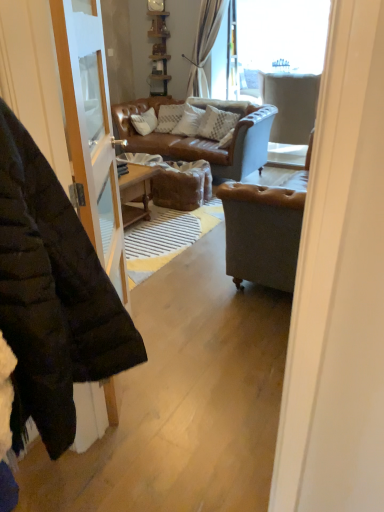
Question: In terms of height, does transparent glass window at upper center look taller or shorter compared to textured beige pillow at center?

Choices:
 (A) short
 (B) tall

Answer: (B)

Question: In terms of size, does transparent glass window at upper center appear bigger or smaller than textured beige pillow at center?

Choices:
 (A) big
 (B) small

Answer: (A)

Question: Based on their relative distances, which object is nearer to the black puffer jacket at left?

Choices:
 (A) transparent glass window at upper center
 (B) textured beige pillow at center
 (C) light gray fabric armchair at upper right

Answer: (B)

Question: Which object is the closest to the light gray fabric armchair at upper right?

Choices:
 (A) transparent glass window at upper center
 (B) textured beige pillow at center
 (C) black puffer jacket at left

Answer: (A)